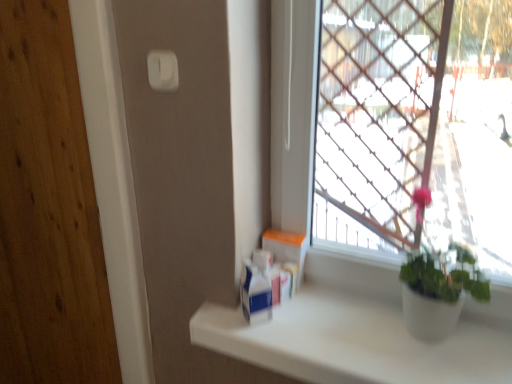
You are a GUI agent. You are given a task and a screenshot of the screen. Output one action in this format:
    pyautogui.click(x=<x>, y=<y>)
    Task: Click on the vacant area on top of white matte counter top at lower right (from a real-world perspective)
    Image resolution: width=512 pixels, height=384 pixels.
    Given the screenshot: What is the action you would take?
    pyautogui.click(x=353, y=327)